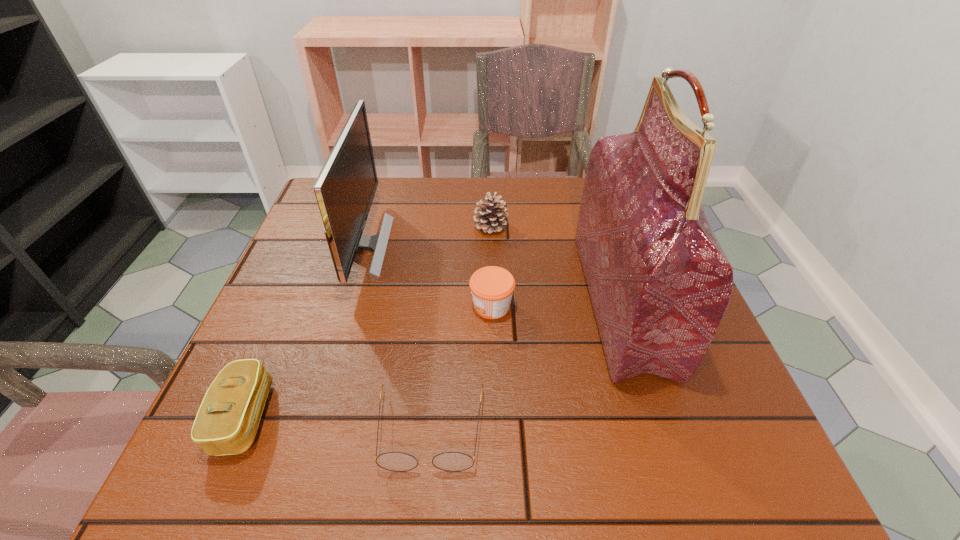
Where is `the tallest object`? This screenshot has height=540, width=960. the tallest object is located at coordinates (659, 281).

Find the location of a particular element. Image resolution: width=960 pixels, height=540 pixels. handbag is located at coordinates (659, 281).

What are the coordinates of `the fifth shortest object` in the screenshot? It's located at (345, 188).

Locate an element on the screen. The image size is (960, 540). the fifth object from right to left is located at coordinates (345, 188).

Find the location of a particular element. The width and height of the screenshot is (960, 540). the fourth shortest object is located at coordinates (490, 218).

Find the location of a particular element. The width and height of the screenshot is (960, 540). jam is located at coordinates (492, 287).

This screenshot has width=960, height=540. Find the location of `clutch bag`. clutch bag is located at coordinates (228, 418).

The image size is (960, 540). I want to click on the shortest object, so click(393, 461).

Image resolution: width=960 pixels, height=540 pixels. I want to click on vacant region located on the front-facing side of the handbag, so click(405, 301).

Where is `free point located on the front-facing side of the handbag`? This screenshot has height=540, width=960. free point located on the front-facing side of the handbag is located at coordinates (557, 301).